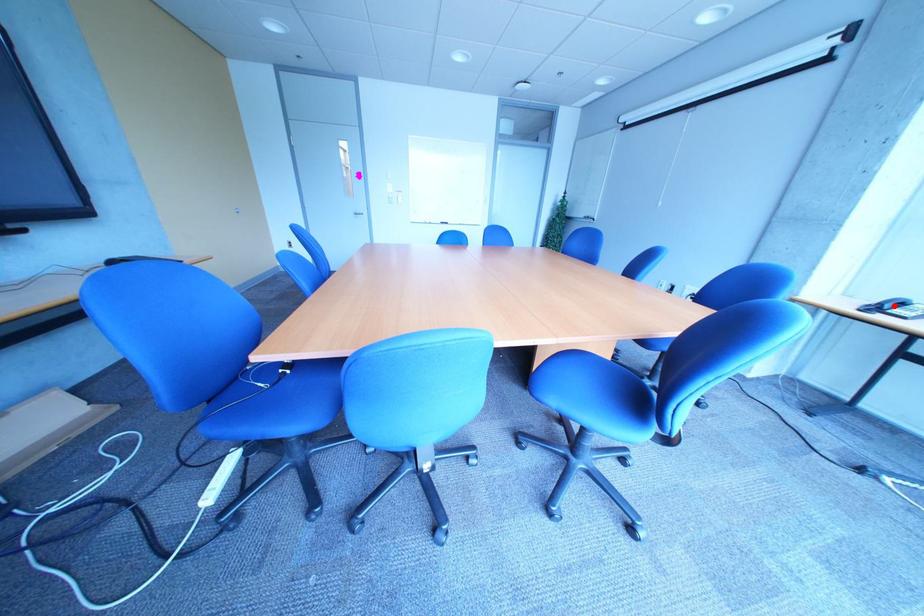
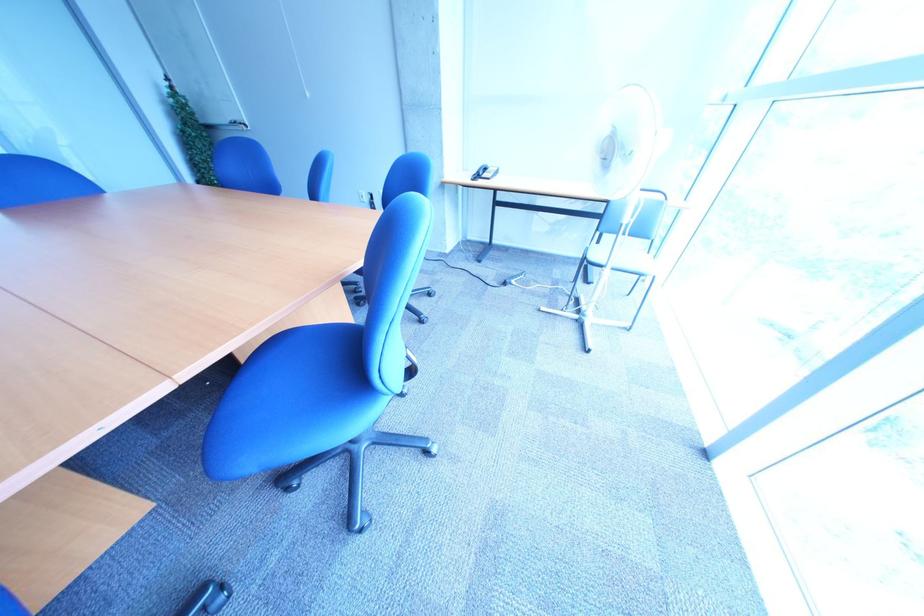
Locate, in the second image, the point that corresponds to the highlighted location in the first image.

(492, 174)